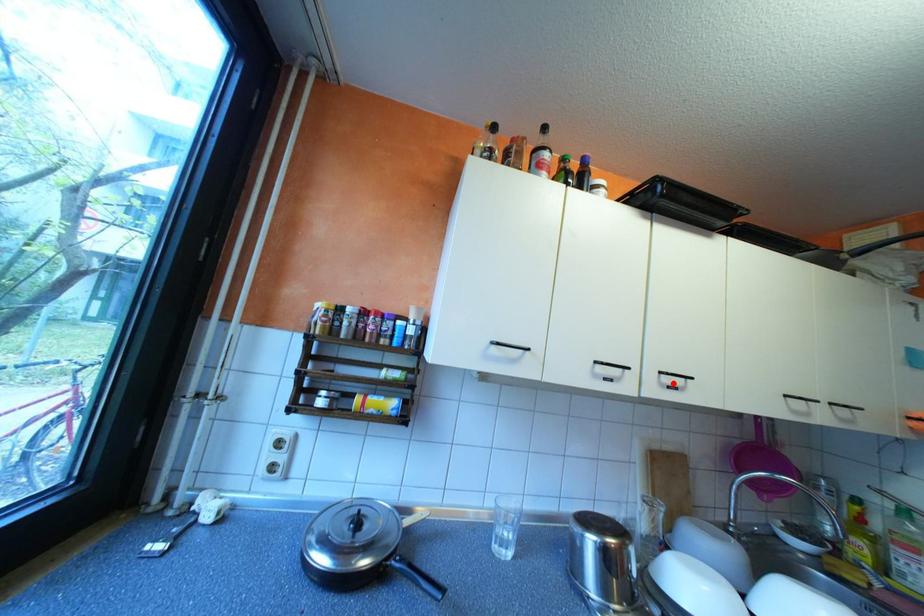
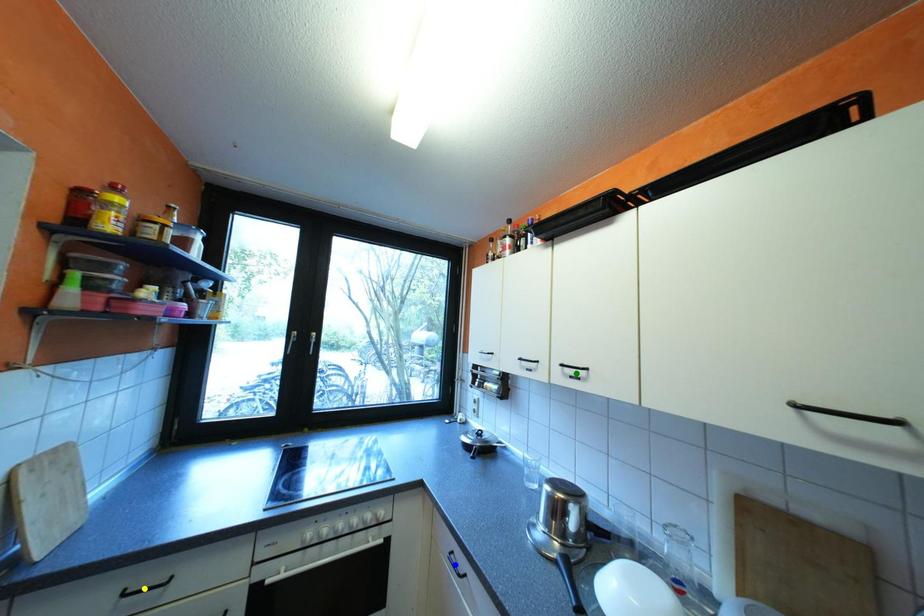
Question: I am providing you with two images of the same scene from different viewpoints. A red point is marked on the first image. You are given multiple points on the second image. Which spot in image 2 lines up with the point in image 1?

Choices:
 (A) blue point
 (B) green point
 (C) yellow point

Answer: (B)